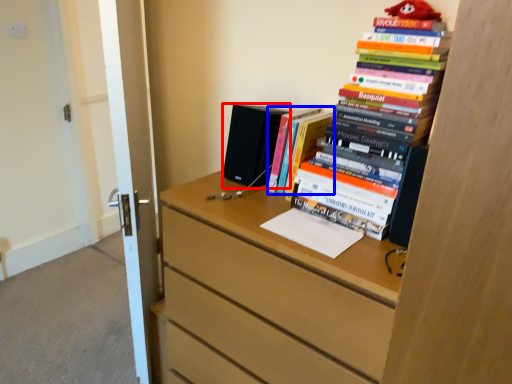
Question: Which object appears farthest to the camera in this image, speaker (highlighted by a red box) or book (highlighted by a blue box)?

Choices:
 (A) speaker
 (B) book

Answer: (A)